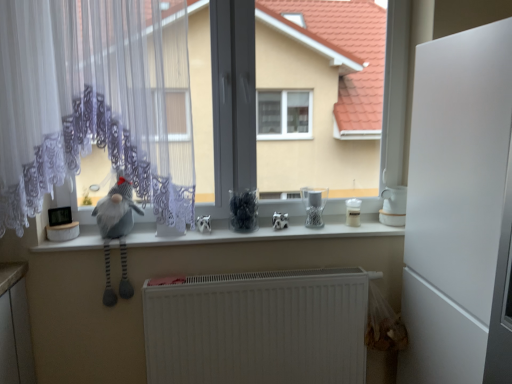
Identify the location of vacant area that lies to the right of clear glass jar at center, marked as the first appliance in a left-to-right arrangement. (347, 226).